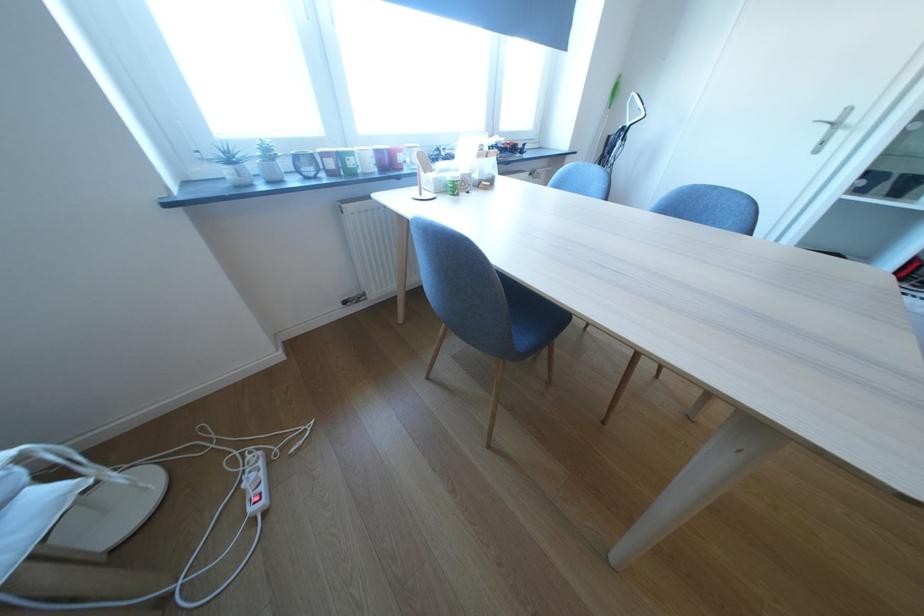
Find where to press the red power strip switch. Please return your answer as a coordinate pair (x, y).

(254, 500)